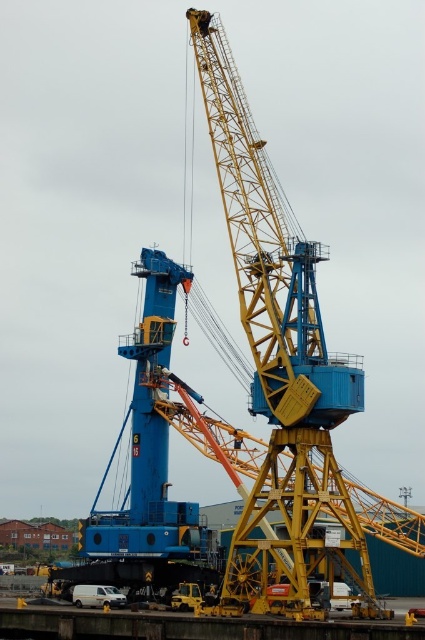
You are a crane operator who needs to lower a heavy container onto the yellow metal dock at lower center. The yellow metallic crane at center is currently holding the container. Is there enough vertical space between the crane and the dock to safely lower the container?

The yellow metallic crane at center is located above the yellow metal dock at lower center, so there is sufficient vertical space to safely lower the container from the yellow metallic crane at center to the yellow metal dock at lower center.

You are standing at the point with coordinates (280, 353) in the image. Which object are you currently located on?

The point at coordinates (280, 353) is located on the yellow metallic crane at center.

Consider the image. You are a crane operator who needs to determine if the yellow metallic crane at center can lift a heavy container placed on the yellow metal dock at lower center. Based on their sizes, can the crane reach the dock?

The yellow metallic crane at center is bigger than the yellow metal dock at lower center, so it is likely capable of reaching and lifting the container from the dock.